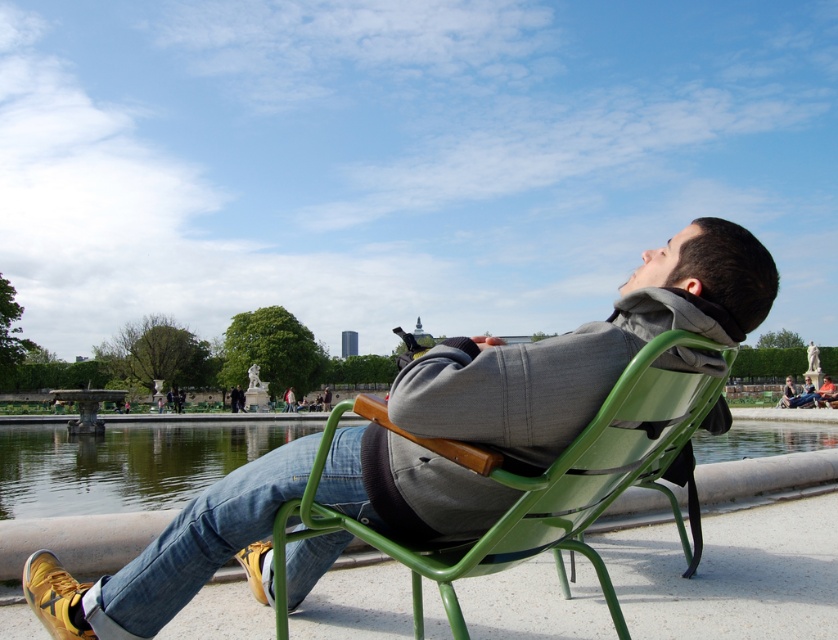
Looking at this image, you are a maintenance worker checking the park facilities. You see the green metal chair at center and the clear water at chair right. Which object is higher in elevation?

The green metal chair at center is higher in elevation than the clear water at chair right because the green metal chair at center is above clear water at chair right.

You are a photographer trying to capture the reflection of the matte gray jacket at center in the clear water at chair right. Is the jacket positioned in a way that its reflection would be visible in the water?

The matte gray jacket at center is above clear water at chair right, so its reflection should be visible in the water since it is positioned directly above it.

You are a park visitor standing at the entrance and want to locate the person in the green metal lounge chair by the water. According to the image, where should you look relative to the point marked at coordinates (583, 349)?

The point at (583, 349) is on the matte gray jacket at center, so the person in the green metal lounge chair by the water is located near that point.